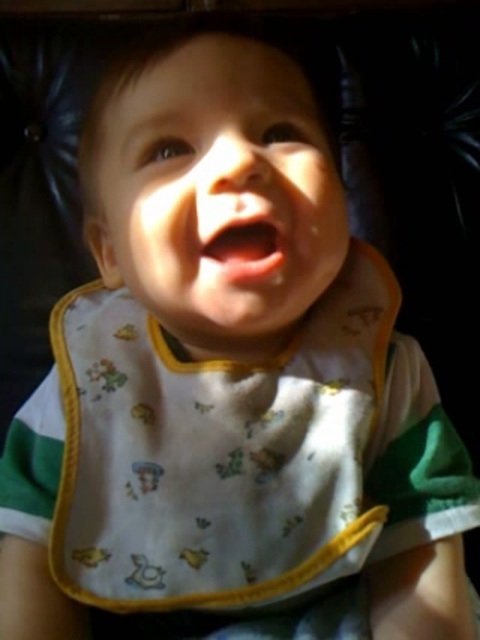
You are a photographer trying to capture the baby in the image. You notice two points in the scene at coordinates point (230, 604) and point (269, 100). If you want to focus on the point that is closer to the camera, which coordinate should you choose?

Point (269, 100) is closer to the camera than point (230, 604), so you should focus on point (269, 100).

You are a photographer trying to capture the baby in the image. Since the light source is on the left, where should you position your camera to best highlight both the smooth skin face at center and the pink glossy lips at center?

The smooth skin face at center is in front of the pink glossy lips at center, so positioning the camera to the right side of the baby would allow the light from the left to illuminate both the face and lips effectively without casting shadows over them.